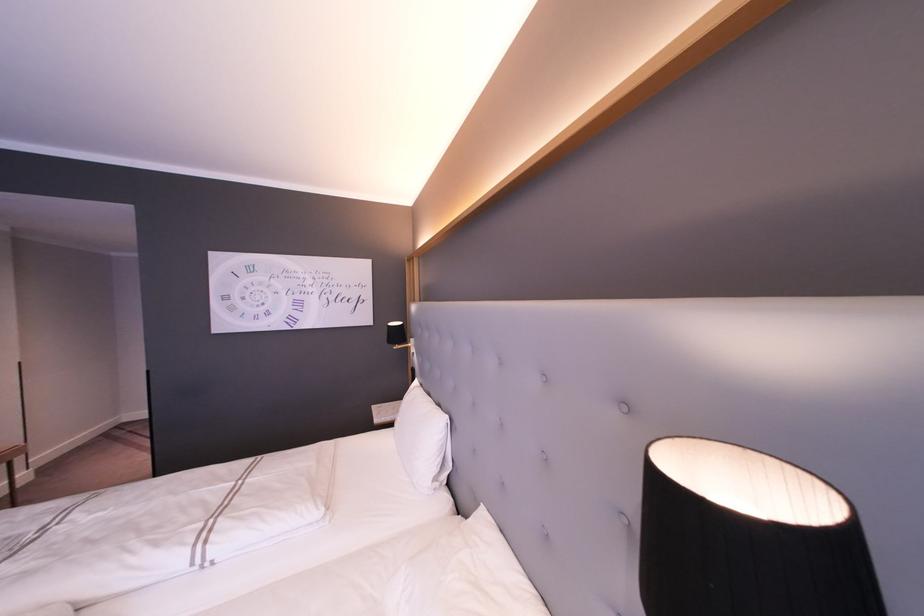
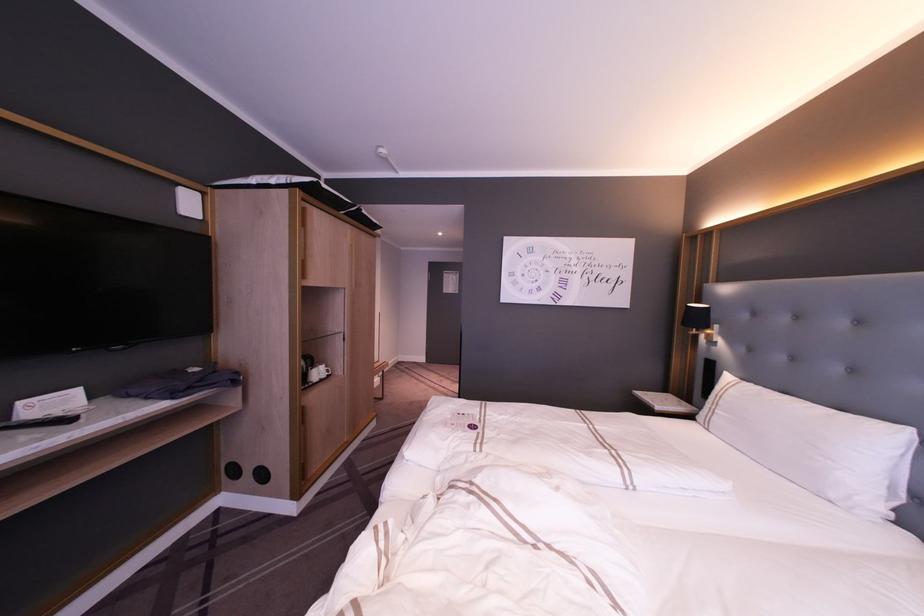
Locate, in the second image, the point that corresponds to pixel 446 416 in the first image.

(910, 429)